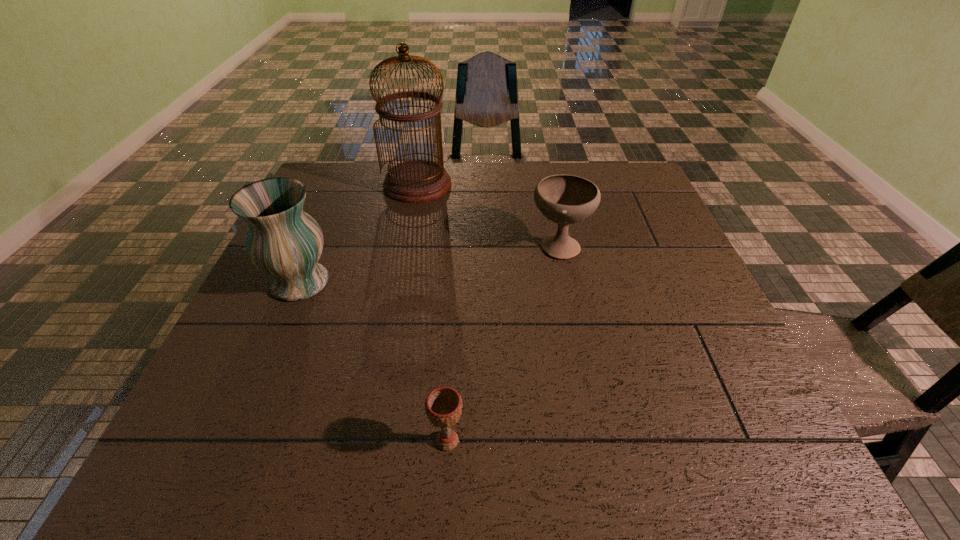
Find the location of a particular element. This screenshot has width=960, height=540. free space located on the left of the farther chalice is located at coordinates (380, 245).

You are a GUI agent. You are given a task and a screenshot of the screen. Output one action in this format:
    pyautogui.click(x=<x>, y=<y>)
    Task: Click on the free space located 0.320m on the left of the left chalice
    Image resolution: width=960 pixels, height=540 pixels.
    Given the screenshot: What is the action you would take?
    pyautogui.click(x=245, y=441)

Locate an element on the screen. The height and width of the screenshot is (540, 960). object situated at the far edge is located at coordinates (415, 181).

Where is `object that is at the near edge`? The width and height of the screenshot is (960, 540). object that is at the near edge is located at coordinates (443, 406).

At what (x,y) coordinates should I click in order to perform the action: click on object located in the left edge section of the desktop. Please return your answer as a coordinate pair (x, y). Looking at the image, I should click on (283, 241).

The width and height of the screenshot is (960, 540). In the image, there is a desktop. In order to click on vacant space at the far edge in this screenshot , I will do `click(515, 172)`.

This screenshot has width=960, height=540. Identify the location of vacant space at the near edge. (612, 453).

Where is `vacant region at the left edge`? This screenshot has width=960, height=540. vacant region at the left edge is located at coordinates (270, 293).

This screenshot has height=540, width=960. In the image, there is a desktop. Identify the location of vacant space at the right edge. (718, 365).

Where is `vacant space at the far left corner`? Image resolution: width=960 pixels, height=540 pixels. vacant space at the far left corner is located at coordinates (348, 177).